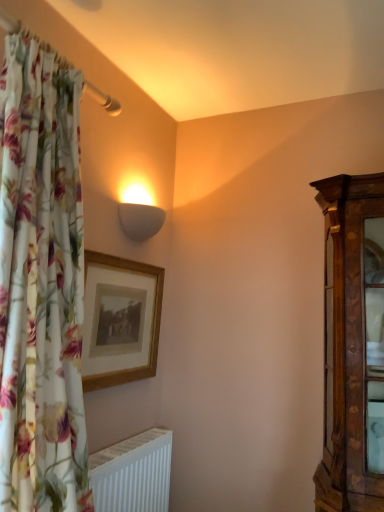
Question: Is white matte radiator at lower left further to the viewer compared to wooden picture frame at upper center?

Choices:
 (A) no
 (B) yes

Answer: (A)

Question: Is wooden picture frame at upper center completely or partially inside white matte radiator at lower left?

Choices:
 (A) yes
 (B) no

Answer: (B)

Question: Can you confirm if white matte radiator at lower left is bigger than wooden picture frame at upper center?

Choices:
 (A) no
 (B) yes

Answer: (B)

Question: Does white matte radiator at lower left lie in front of wooden picture frame at upper center?

Choices:
 (A) yes
 (B) no

Answer: (A)

Question: From a real-world perspective, is white matte radiator at lower left located higher than wooden picture frame at upper center?

Choices:
 (A) no
 (B) yes

Answer: (A)

Question: Is wooden picture frame at upper center in front of or behind white matte wall sconce at upper center in the image?

Choices:
 (A) behind
 (B) front

Answer: (B)

Question: From a real-world perspective, is wooden picture frame at upper center physically located above or below white matte wall sconce at upper center?

Choices:
 (A) above
 (B) below

Answer: (B)

Question: Is point (87, 260) positioned closer to the camera than point (124, 220)?

Choices:
 (A) farther
 (B) closer

Answer: (B)

Question: From their relative heights in the image, would you say wooden picture frame at upper center is taller or shorter than white matte wall sconce at upper center?

Choices:
 (A) short
 (B) tall

Answer: (B)

Question: Visually, is white matte radiator at lower left positioned to the left or to the right of white matte wall sconce at upper center?

Choices:
 (A) right
 (B) left

Answer: (B)

Question: From a real-world perspective, relative to white matte wall sconce at upper center, is white matte radiator at lower left vertically above or below?

Choices:
 (A) below
 (B) above

Answer: (A)

Question: Is white matte radiator at lower left taller or shorter than white matte wall sconce at upper center?

Choices:
 (A) tall
 (B) short

Answer: (A)

Question: Would you say white matte radiator at lower left is inside or outside white matte wall sconce at upper center?

Choices:
 (A) outside
 (B) inside

Answer: (A)

Question: From the image's perspective, is white matte radiator at lower left located above or below wooden picture frame at upper center?

Choices:
 (A) above
 (B) below

Answer: (B)

Question: Is white matte radiator at lower left wider or thinner than wooden picture frame at upper center?

Choices:
 (A) wide
 (B) thin

Answer: (A)